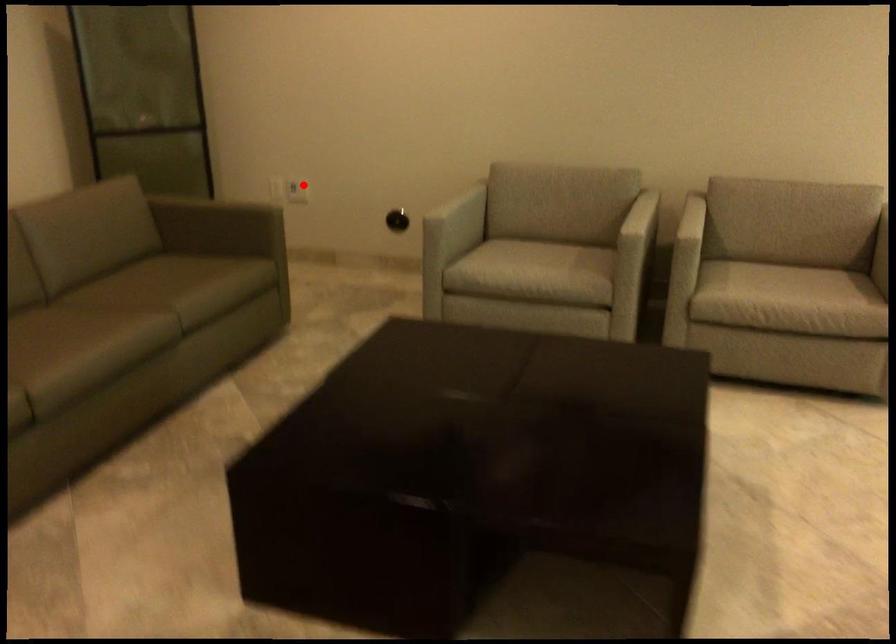
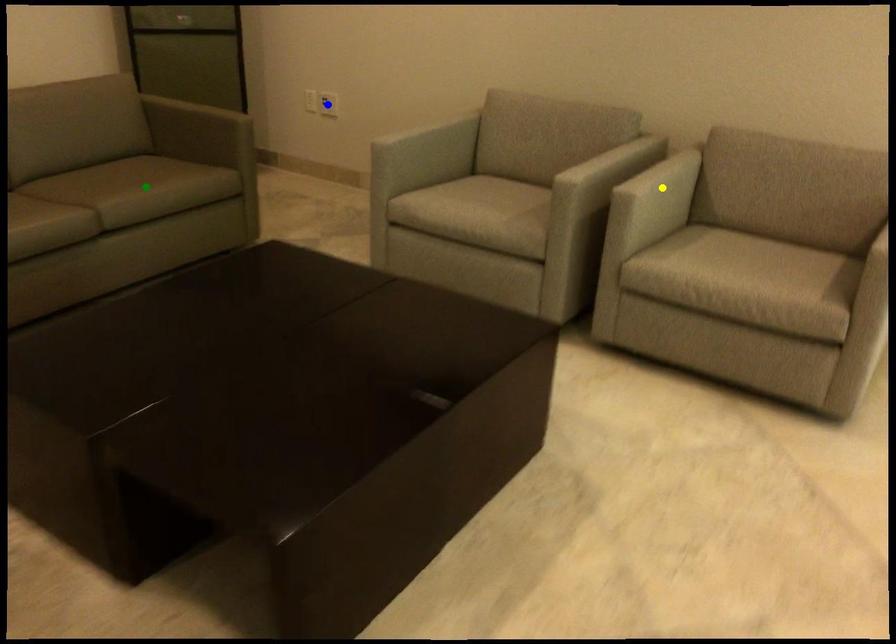
Question: I am providing you with two images of the same scene from different viewpoints. A red point is marked on the first image. You are given multiple points on the second image. Which spot in image 2 lines up with the point in image 1?

Choices:
 (A) blue point
 (B) yellow point
 (C) green point

Answer: (A)